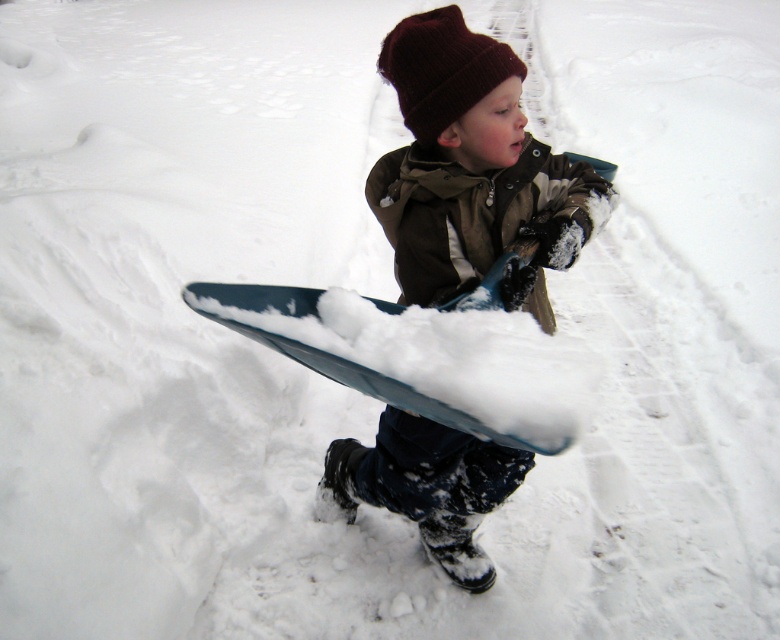
You are a photographer trying to capture a photo of the child and their sled. You want to ensure both the burgundy knit beanie at upper center and the blue plastic snowboard at center are clearly visible. Which object should you focus on first to ensure proper focus, considering their sizes?

The burgundy knit beanie at upper center is smaller than the blue plastic snowboard at center. To ensure proper focus on both objects, you should focus on the smaller object first, which is the burgundy knit beanie at upper center, as it requires more precise focus due to its smaller size.

You are a photographer trying to capture a photo of the child and their sled. You want to ensure both the burgundy knit beanie at upper center and the blue plastic snowboard at center are clearly visible. Based on their sizes, which object should you focus on first to ensure proper focus?

The burgundy knit beanie at upper center is taller than the blue plastic snowboard at center, so focusing on the taller object first will ensure proper focus for both.